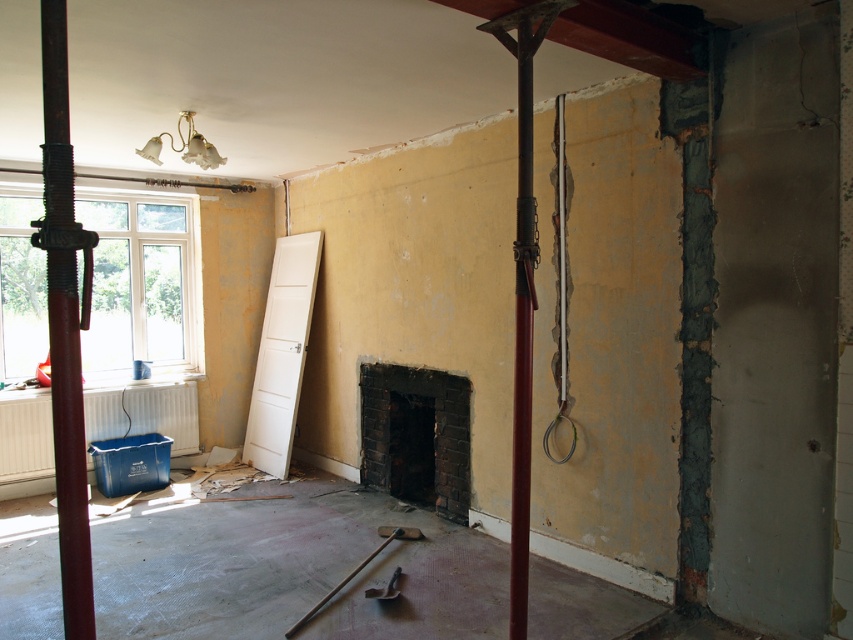
Which is in front, point (61, 225) or point (387, 589)?

Point (61, 225)

Is rusty metal pole at left in front of metallic silver hammer at center?

Yes.

Which is behind, point (78, 460) or point (368, 589)?

The point (368, 589) is more distant.

Find the location of `rusty metal pole at left`. rusty metal pole at left is located at coordinates (65, 326).

Is black brick fireplace at center positioned behind metallic silver hammer at center?

Yes, it is.

Between point (428, 401) and point (387, 588), which one is positioned behind?

The point (428, 401) is more distant.

Who is more forward, [450,467] or [396,589]?

Point [396,589] is more forward.

This screenshot has height=640, width=853. I want to click on black brick fireplace at center, so click(x=416, y=435).

In the scene shown: Who is shorter, rusty metal pole at left or black brick fireplace at center?

Standing shorter between the two is black brick fireplace at center.

Does rusty metal pole at left appear on the left side of black brick fireplace at center?

Correct, you'll find rusty metal pole at left to the left of black brick fireplace at center.

Does point (62, 477) come closer to viewer compared to point (399, 385)?

Yes, point (62, 477) is in front of point (399, 385).

Where is `rusty metal pole at left`? This screenshot has width=853, height=640. rusty metal pole at left is located at coordinates (65, 326).